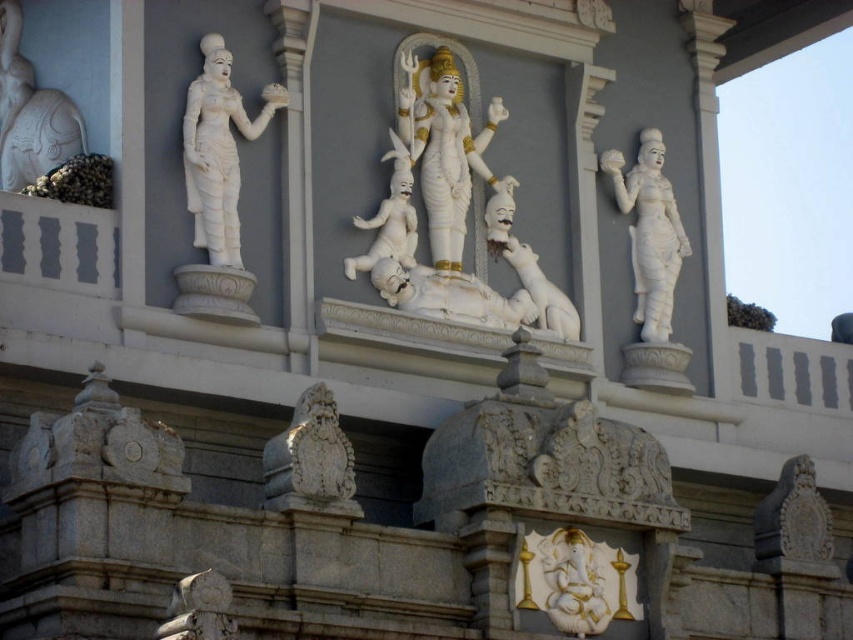
You are a temple visitor standing between the white marble statue at left and the white marble statue at right. You want to place a 10 meter long offering mat between them. Will the offering mat fit between the two statues?

The distance between the white marble statue at left and the white marble statue at right is 15.60 meters, which is greater than the 10 meter length of the offering mat. Therefore, the offering mat will fit between the two statues.

You are standing at the center of the temple structure. You want to locate the white marble statue at right. In which direction should you look?

→ You should look to the right direction to find the white marble statue at right.